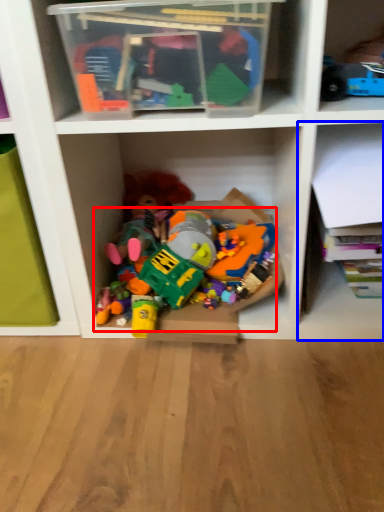
Question: Which of the following is the closest to the observer, toy (highlighted by a red box) or shelf (highlighted by a blue box)?

Choices:
 (A) toy
 (B) shelf

Answer: (B)